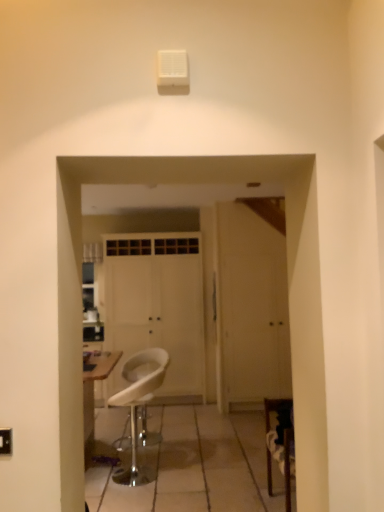
Question: Is white matte door at center, placed as the second door when sorted from left to right, wider than white matte door at center, the 2th door from the right?

Choices:
 (A) no
 (B) yes

Answer: (A)

Question: Is white matte door at center, placed as the second door when sorted from left to right, shorter than white matte door at center, the 2th door from the right?

Choices:
 (A) yes
 (B) no

Answer: (A)

Question: Would you say white matte door at center, placed as the second door when sorted from left to right, is outside white matte door at center, marked as the 1th door in a left-to-right arrangement?

Choices:
 (A) yes
 (B) no

Answer: (A)

Question: Does white matte door at center, placed as the second door when sorted from left to right, come behind white matte door at center, marked as the 1th door in a left-to-right arrangement?

Choices:
 (A) yes
 (B) no

Answer: (B)

Question: Does white matte door at center, placed as the second door when sorted from left to right, appear on the right side of white matte door at center, the 2th door from the right?

Choices:
 (A) no
 (B) yes

Answer: (B)

Question: Is white matte door at center, placed as the second door when sorted from left to right, positioned with its back to white matte door at center, marked as the 1th door in a left-to-right arrangement?

Choices:
 (A) yes
 (B) no

Answer: (B)

Question: Is white matte door at center, placed as the second door when sorted from left to right, located within white matte door at center, marked as the 1th door in a left-to-right arrangement?

Choices:
 (A) no
 (B) yes

Answer: (A)

Question: Can you see white matte door at center, marked as the 1th door in a left-to-right arrangement, touching white matte door at center, which is the first door in right-to-left order?

Choices:
 (A) no
 (B) yes

Answer: (A)

Question: From a real-world perspective, is white matte door at center, the 2th door from the right, physically above white matte door at center, which is the first door in right-to-left order?

Choices:
 (A) no
 (B) yes

Answer: (B)

Question: Does white matte door at center, marked as the 1th door in a left-to-right arrangement, lie behind white matte door at center, placed as the second door when sorted from left to right?

Choices:
 (A) yes
 (B) no

Answer: (A)

Question: Can you confirm if white matte door at center, marked as the 1th door in a left-to-right arrangement, is smaller than white matte door at center, which is the first door in right-to-left order?

Choices:
 (A) no
 (B) yes

Answer: (A)

Question: Is white matte door at center, the 2th door from the right, not close to white matte door at center, placed as the second door when sorted from left to right?

Choices:
 (A) no
 (B) yes

Answer: (A)

Question: Considering the relative positions of white plastic stool at center and white matte door at center, which is the first door in right-to-left order, in the image provided, is white plastic stool at center in front of white matte door at center, which is the first door in right-to-left order,?

Choices:
 (A) yes
 (B) no

Answer: (A)